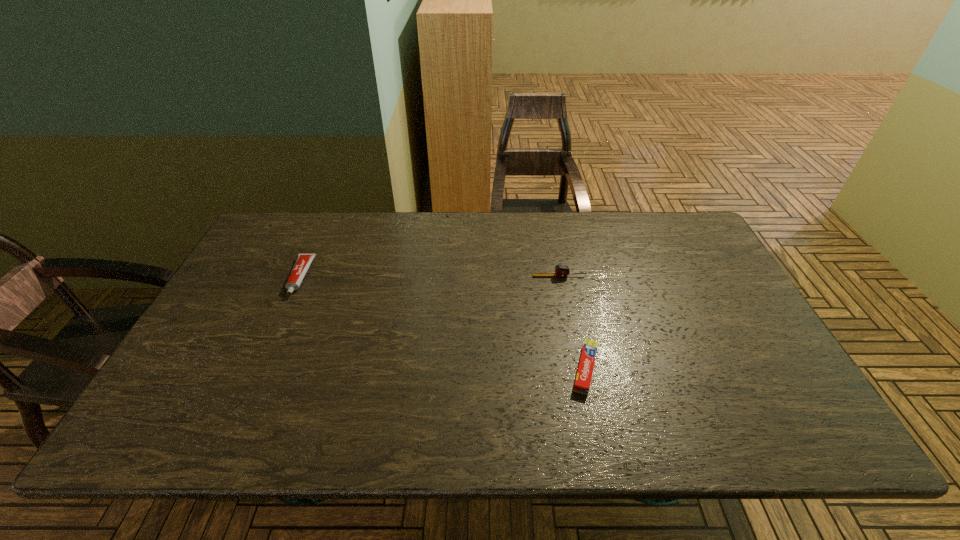
What are the coordinates of `vacant area at the left edge of the desktop` in the screenshot? It's located at (273, 284).

Image resolution: width=960 pixels, height=540 pixels. Find the location of `vacant space at the right edge of the desktop`. vacant space at the right edge of the desktop is located at coordinates (706, 286).

In the image, there is a desktop. Identify the location of free space at the far left corner. (283, 214).

In the image, there is a desktop. Identify the location of free region at the far right corner. Image resolution: width=960 pixels, height=540 pixels. (658, 219).

I want to click on vacant space at the near right corner of the desktop, so 796,443.

The height and width of the screenshot is (540, 960). What are the coordinates of `vacant area that lies between the shorter toothpaste and the farther toothpaste` in the screenshot? It's located at (443, 323).

I want to click on vacant area that lies between the farther toothpaste and the nearest object, so click(x=443, y=323).

Where is `vacant area that lies between the right toothpaste and the taller toothpaste`? Image resolution: width=960 pixels, height=540 pixels. vacant area that lies between the right toothpaste and the taller toothpaste is located at coordinates (443, 323).

The width and height of the screenshot is (960, 540). I want to click on vacant region between the nearer toothpaste and the tape measure, so click(572, 323).

Image resolution: width=960 pixels, height=540 pixels. Identify the location of free space between the tape measure and the farther toothpaste. (430, 276).